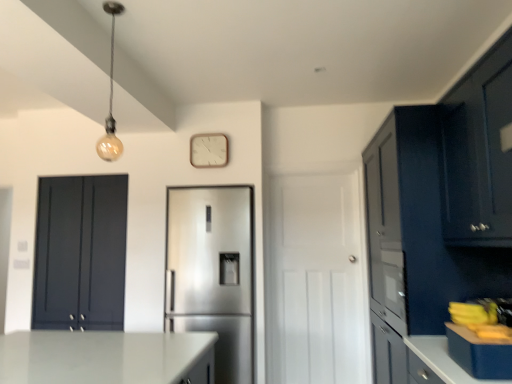
What do you see at coordinates (479, 153) in the screenshot? I see `matte dark blue cabinet at upper right, the first cabinetry viewed from the front` at bounding box center [479, 153].

How much space does matte dark blue cabinet at upper right, which is the 1th cabinetry from right to left, occupy vertically?

It is 31.77 inches.

Where is `matte glass bulb at upper left`? This screenshot has height=384, width=512. matte glass bulb at upper left is located at coordinates (110, 98).

Locate an element on the screen. This screenshot has width=512, height=384. matte dark blue cabinet at right, positioned as the 2th cabinetry in back-to-front order is located at coordinates (439, 214).

How much distance is there between satin silver refrigerator at center and wooden clock at upper center?

30.31 inches.

Which object is thinner, satin silver refrigerator at center or wooden clock at upper center?

With smaller width is wooden clock at upper center.

Does satin silver refrigerator at center appear on the left side of wooden clock at upper center?

In fact, satin silver refrigerator at center is to the right of wooden clock at upper center.

From the image's perspective, is matte dark blue cabinet at left, the 1th cabinetry in the left-to-right sequence, on white matte door at center?

Indeed, from the image's perspective, matte dark blue cabinet at left, the 1th cabinetry in the left-to-right sequence, is shown above white matte door at center.

Would you say matte dark blue cabinet at left, which is the third cabinetry from right to left, is inside or outside white matte door at center?

matte dark blue cabinet at left, which is the third cabinetry from right to left, is not enclosed by white matte door at center.

Which of these two, matte dark blue cabinet at left, placed as the third cabinetry when sorted from front to back, or white matte door at center, stands taller?

white matte door at center is taller.

How far apart are matte dark blue cabinet at left, placed as the third cabinetry when sorted from front to back, and white matte door at center?

matte dark blue cabinet at left, placed as the third cabinetry when sorted from front to back, and white matte door at center are 5.33 feet apart.

Between point (85, 311) and point (225, 161), which one is positioned behind?

Point (85, 311)

Between matte dark blue cabinet at left, the first cabinetry when ordered from back to front, and wooden clock at upper center, which one has smaller size?

With smaller size is wooden clock at upper center.

Is wooden clock at upper center completely or partially inside matte dark blue cabinet at left, which is the third cabinetry from right to left?

No, matte dark blue cabinet at left, which is the third cabinetry from right to left, does not contain wooden clock at upper center.

Considering the positions of points (196, 159) and (223, 187), is point (196, 159) closer to camera compared to point (223, 187)?

No.

Which is correct: wooden clock at upper center is inside satin silver refrigerator at center, or outside of it?

The correct answer is: outside.

From a real-world perspective, which object rests below the other?

satin silver refrigerator at center is physically lower.

Is the depth of wooden clock at upper center greater than that of satin silver refrigerator at center?

Yes, wooden clock at upper center is further from the camera.

This screenshot has width=512, height=384. Find the location of `counter top lying in front of the matte dark blue cabinet at right, marked as the second cabinetry in a front-to-back arrangement`. counter top lying in front of the matte dark blue cabinet at right, marked as the second cabinetry in a front-to-back arrangement is located at coordinates (442, 359).

In terms of height, does matte dark blue cabinet at right, the 2th cabinetry from the right, look taller or shorter compared to blue matte countertop at right?

Clearly, matte dark blue cabinet at right, the 2th cabinetry from the right, is taller compared to blue matte countertop at right.

Does matte dark blue cabinet at right, positioned as the 2th cabinetry in back-to-front order, have a smaller size compared to blue matte countertop at right?

Actually, matte dark blue cabinet at right, positioned as the 2th cabinetry in back-to-front order, might be larger than blue matte countertop at right.

Considering the relative positions of matte dark blue cabinet at right, positioned as the 2th cabinetry in back-to-front order, and blue matte countertop at right in the image provided, is matte dark blue cabinet at right, positioned as the 2th cabinetry in back-to-front order, to the left of blue matte countertop at right from the viewer's perspective?

Incorrect, matte dark blue cabinet at right, positioned as the 2th cabinetry in back-to-front order, is not on the left side of blue matte countertop at right.

Is the surface of blue matte countertop at right in direct contact with matte dark blue cabinet at right, marked as the second cabinetry in a front-to-back arrangement?

No, blue matte countertop at right is not next to matte dark blue cabinet at right, marked as the second cabinetry in a front-to-back arrangement.

From a real-world perspective, is blue matte countertop at right positioned above or below matte dark blue cabinet at right, the 2th cabinetry from the right?

In terms of real-world spatial position, blue matte countertop at right is below matte dark blue cabinet at right, the 2th cabinetry from the right.

Does blue matte countertop at right have a larger size compared to matte dark blue cabinet at right, marked as the second cabinetry in a left-to-right arrangement?

No, blue matte countertop at right is not bigger than matte dark blue cabinet at right, marked as the second cabinetry in a left-to-right arrangement.

From the picture: From the image's perspective, which one is positioned higher, blue matte countertop at right or white matte door at center?

blue matte countertop at right.

From a real-world perspective, which is physically above, blue matte countertop at right or white matte door at center?

In real-world perspective, white matte door at center is above.

What's the angular difference between blue matte countertop at right and white matte door at center's facing directions?

They differ by 89.3 degrees in their facing directions.

This screenshot has height=384, width=512. In order to click on clock that is above the satin silver refrigerator at center (from a real-world perspective) in this screenshot , I will do `click(209, 150)`.

Where is `door that appears below the matte dark blue cabinet at left, which is the third cabinetry from right to left (from the image's perspective)`? The image size is (512, 384). door that appears below the matte dark blue cabinet at left, which is the third cabinetry from right to left (from the image's perspective) is located at coordinates (315, 281).

Considering their positions, is wooden clock at upper center positioned closer to matte dark blue cabinet at right, marked as the second cabinetry in a front-to-back arrangement, than matte dark blue cabinet at left, the 1th cabinetry in the left-to-right sequence?

Among the two, wooden clock at upper center is located nearer to matte dark blue cabinet at right, marked as the second cabinetry in a front-to-back arrangement.

Which object lies further to the anchor point matte dark blue cabinet at left, placed as the third cabinetry when sorted from front to back, matte dark blue cabinet at upper right, which ranks as the 3th cabinetry in back-to-front order, or satin silver refrigerator at center?

matte dark blue cabinet at upper right, which ranks as the 3th cabinetry in back-to-front order.

When comparing their distances from matte dark blue cabinet at left, the first cabinetry when ordered from back to front, does satin silver refrigerator at center or wooden clock at upper center seem further?

Based on the image, wooden clock at upper center appears to be further to matte dark blue cabinet at left, the first cabinetry when ordered from back to front.

Considering their positions, is matte glass bulb at upper left positioned further to matte dark blue cabinet at right, the 2th cabinetry from the right, than blue matte countertop at right?

matte glass bulb at upper left lies further to matte dark blue cabinet at right, the 2th cabinetry from the right, than the other object.

Which object lies nearer to the anchor point matte glass bulb at upper left, wooden clock at upper center or matte dark blue cabinet at upper right, positioned as the 3th cabinetry in left-to-right order?

wooden clock at upper center is closer to matte glass bulb at upper left.

Estimate the real-world distances between objects in this image. Which object is further from white matte door at center, satin silver refrigerator at center or matte dark blue cabinet at left, placed as the third cabinetry when sorted from front to back?

matte dark blue cabinet at left, placed as the third cabinetry when sorted from front to back.

Based on their spatial positions, is matte dark blue cabinet at right, positioned as the 2th cabinetry in back-to-front order, or matte dark blue cabinet at upper right, positioned as the 3th cabinetry in left-to-right order, further from satin silver refrigerator at center?

matte dark blue cabinet at upper right, positioned as the 3th cabinetry in left-to-right order, is further to satin silver refrigerator at center.

From the image, which object appears to be nearer to wooden clock at upper center, matte dark blue cabinet at right, the 2th cabinetry from the right, or matte dark blue cabinet at left, the first cabinetry when ordered from back to front?

matte dark blue cabinet at left, the first cabinetry when ordered from back to front, is closer to wooden clock at upper center.

Identify the location of refrigerator positioned between blue matte countertop at right and wooden clock at upper center from near to far. Image resolution: width=512 pixels, height=384 pixels. (213, 272).

Locate an element on the screen. This screenshot has width=512, height=384. door between matte glass bulb at upper left and satin silver refrigerator at center from top to bottom is located at coordinates (315, 281).

Where is `refrigerator positioned between blue matte countertop at right and white matte door at center from near to far`? The image size is (512, 384). refrigerator positioned between blue matte countertop at right and white matte door at center from near to far is located at coordinates (213, 272).

The width and height of the screenshot is (512, 384). In order to click on clock between matte dark blue cabinet at left, placed as the third cabinetry when sorted from front to back, and matte dark blue cabinet at right, marked as the second cabinetry in a front-to-back arrangement, in the horizontal direction in this screenshot , I will do (x=209, y=150).